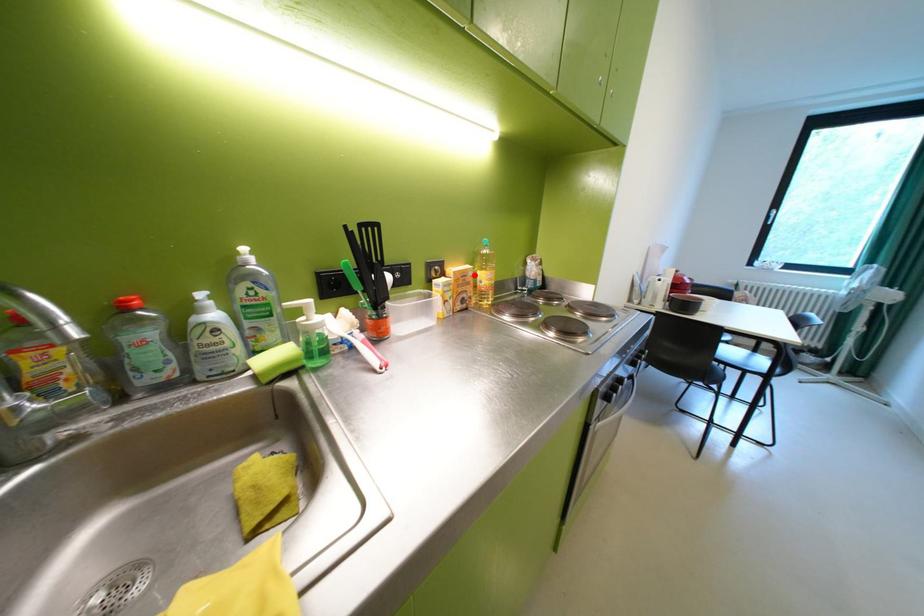
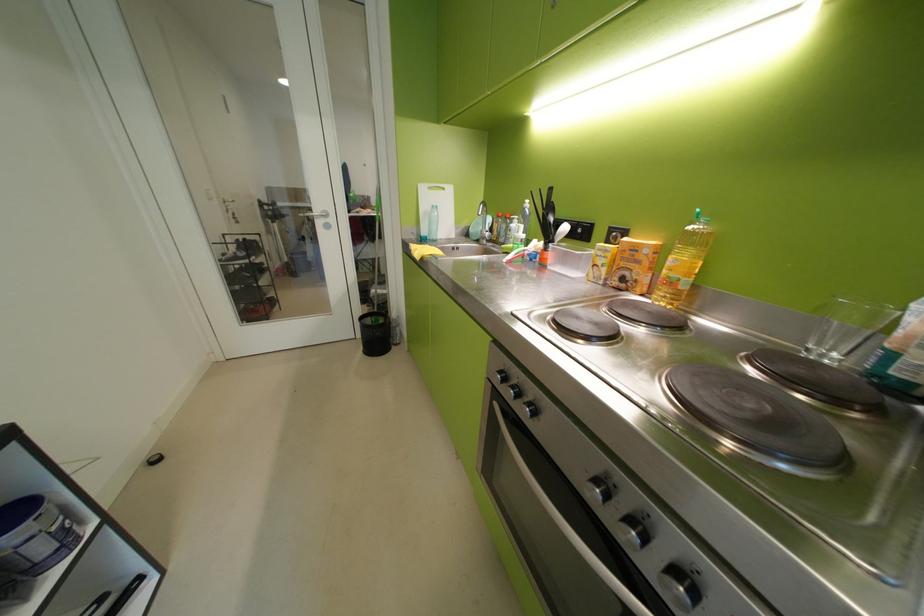
Where in the second image is the point corresponding to the highlighted location from the first image?

(646, 249)